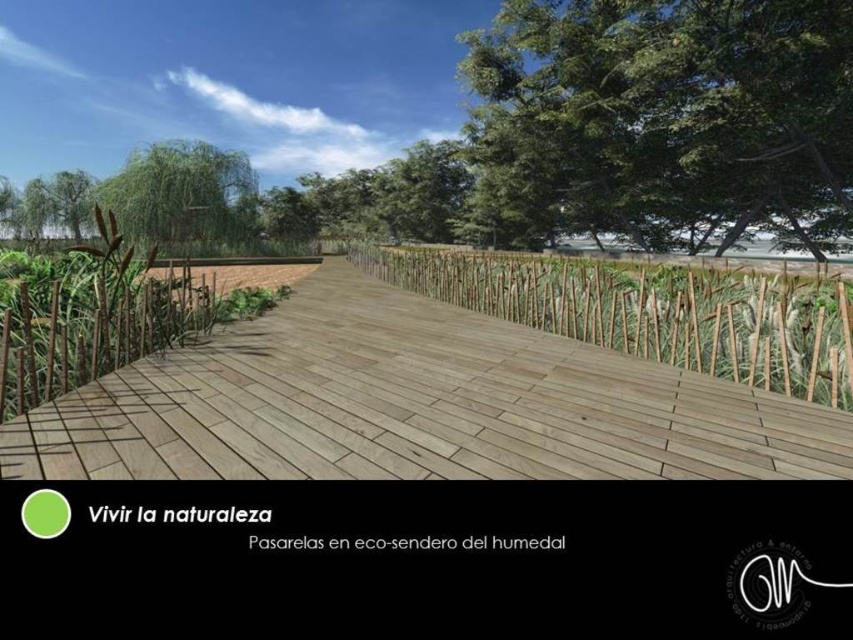
You are standing on the wooden boardwalk and want to place a small potted plant between the wooden at center and the brown textured reed at left. Based on their sizes, which object should the potted plant be closer to?

The wooden at center has a smaller size compared to brown textured reed at left, so the potted plant should be placed closer to the wooden at center to maintain balance between their sizes.